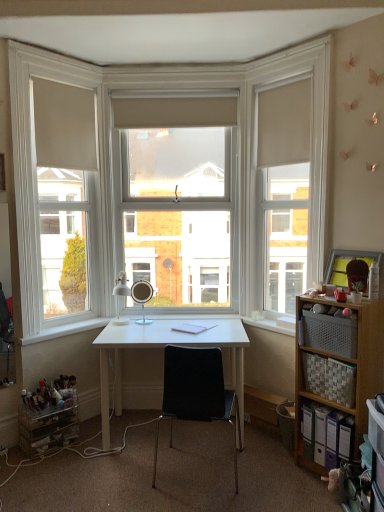
At what (x,y) coordinates should I click in order to perform the action: click on vacant area situated below white glossy desk at center (from a real-world perspective). Please return your answer as a coordinate pair (x, y). Looking at the image, I should click on (174, 434).